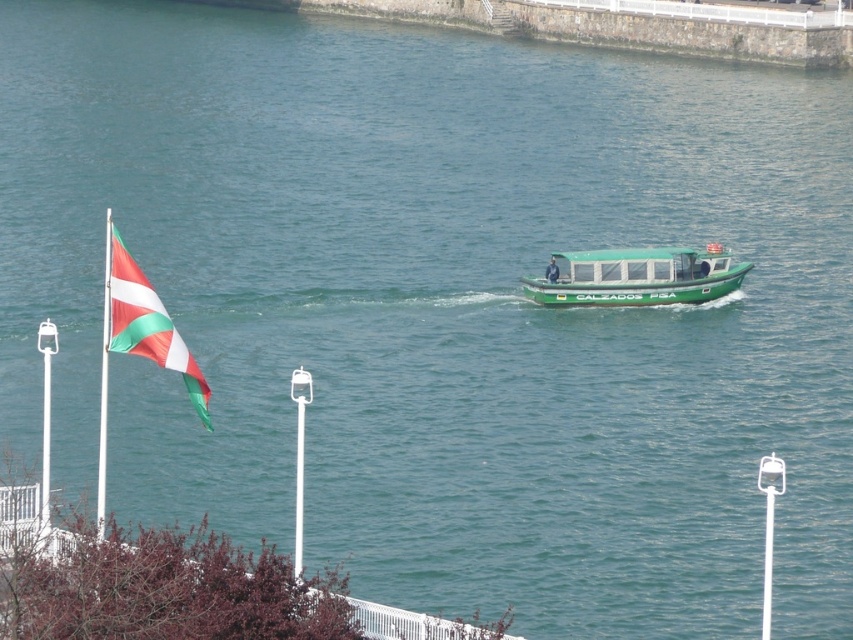
Question: Can you confirm if white-green striped flag at left is positioned to the left of white plastic flag pole at left?

Choices:
 (A) no
 (B) yes

Answer: (A)

Question: Which point is farther from the camera taking this photo?

Choices:
 (A) (173, 326)
 (B) (106, 346)
 (C) (683, 289)

Answer: (C)

Question: Among these objects, which one is farthest from the camera?

Choices:
 (A) green matte boat at center
 (B) white-green striped flag at left
 (C) white plastic flag pole at left

Answer: (A)

Question: Does white-green striped flag at left have a lesser width compared to white plastic flag pole at left?

Choices:
 (A) yes
 (B) no

Answer: (A)

Question: Does green matte boat at center come in front of white plastic flag pole at left?

Choices:
 (A) yes
 (B) no

Answer: (B)

Question: Which object appears closest to the camera in this image?

Choices:
 (A) white-green striped flag at left
 (B) white plastic flag pole at left

Answer: (B)